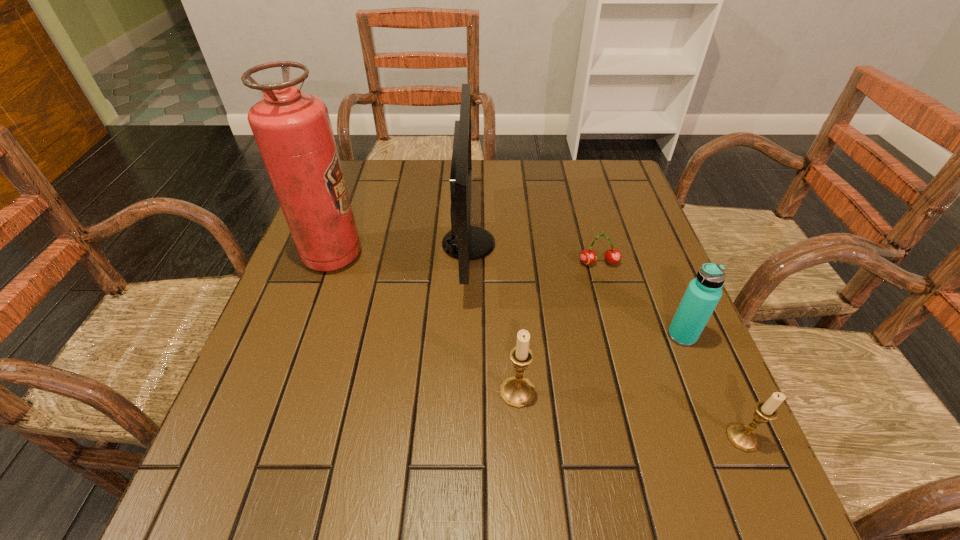
Find the location of a particular element. The width and height of the screenshot is (960, 540). the taller candle holder is located at coordinates (517, 391).

Locate an element on the screen. The image size is (960, 540). the second nearest object is located at coordinates (517, 391).

Where is `the right candle holder`? the right candle holder is located at coordinates (743, 437).

At what (x,y) coordinates should I click in order to perform the action: click on the shorter candle holder. Please return your answer as a coordinate pair (x, y). Looking at the image, I should click on (743, 437).

This screenshot has height=540, width=960. I want to click on computer monitor, so click(x=464, y=242).

The height and width of the screenshot is (540, 960). I want to click on the leftmost object, so click(292, 129).

You are a GUI agent. You are given a task and a screenshot of the screen. Output one action in this format:
    pyautogui.click(x=<x>, y=<y>)
    Task: Click on the fire extinguisher
    The width and height of the screenshot is (960, 540).
    Given the screenshot: What is the action you would take?
    pyautogui.click(x=292, y=129)

Where is `cherry`? The height and width of the screenshot is (540, 960). cherry is located at coordinates (612, 256).

Find the location of a particular element. the shortest object is located at coordinates (612, 256).

This screenshot has height=540, width=960. I want to click on water bottle, so click(x=703, y=293).